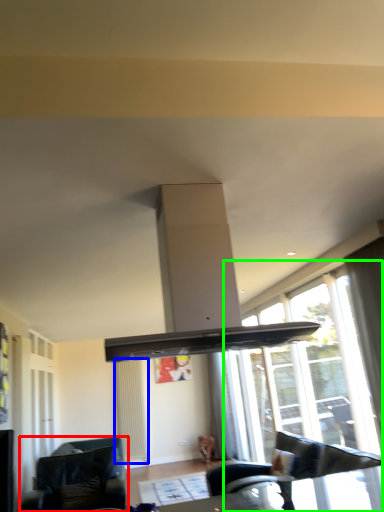
Question: Estimate the real-world distances between objects in this image. Which object is farther from studio couch (highlighted by a red box), radiator (highlighted by a blue box) or window (highlighted by a green box)?

Choices:
 (A) radiator
 (B) window

Answer: (B)